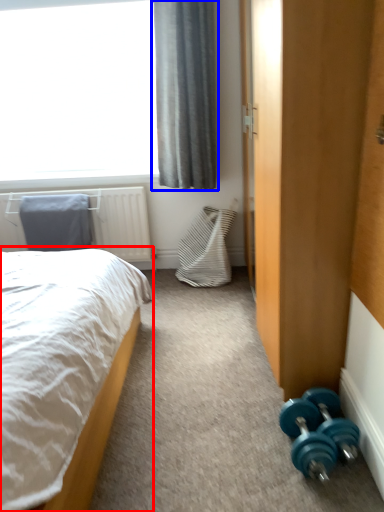
Question: Which of the following is the farthest to the observer, bed (highlighted by a red box) or curtain (highlighted by a blue box)?

Choices:
 (A) bed
 (B) curtain

Answer: (B)